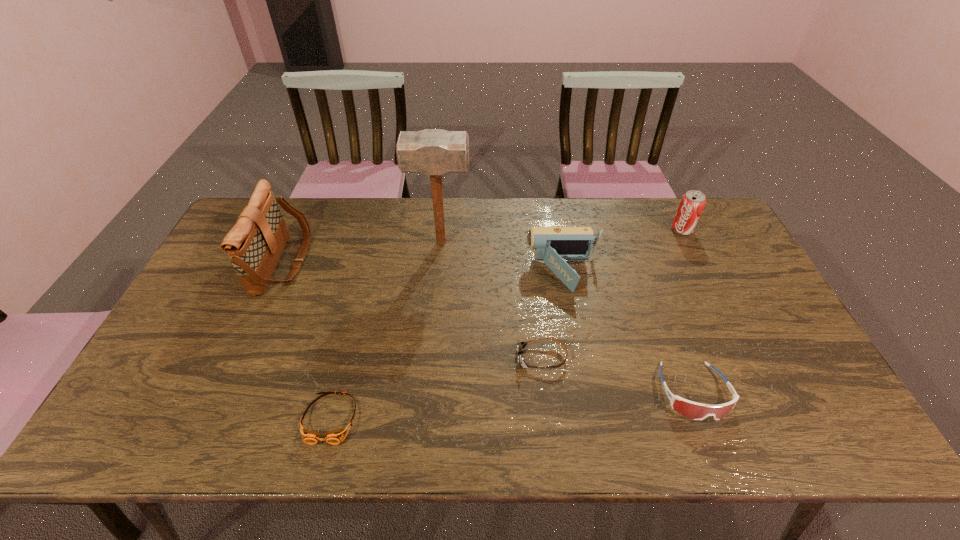
At what (x,y) coordinates should I click in order to perform the action: click on vacant space located 0.290m on the striking face of the tallest object. Please return your answer as a coordinate pair (x, y). Image resolution: width=960 pixels, height=540 pixels. Looking at the image, I should click on (x=559, y=242).

Image resolution: width=960 pixels, height=540 pixels. Find the location of `vacant space located 0.120m on the front-facing side of the leftmost object`. vacant space located 0.120m on the front-facing side of the leftmost object is located at coordinates (343, 262).

You are a GUI agent. You are given a task and a screenshot of the screen. Output one action in this format:
    pyautogui.click(x=<x>, y=<y>)
    Task: Click on the free space located on the left of the rightmost object
    The width and height of the screenshot is (960, 540).
    Given the screenshot: What is the action you would take?
    pyautogui.click(x=651, y=230)

Where is `vacant space located 0.180m on the side of the fourth tallest object with the flip-out screen`? This screenshot has width=960, height=540. vacant space located 0.180m on the side of the fourth tallest object with the flip-out screen is located at coordinates (468, 273).

Locate an element on the screen. vacant area situated on the side of the fourth tallest object with the flip-out screen is located at coordinates 399,273.

Find the location of `vacant space located on the side of the fourth tallest object with the flip-out screen`. vacant space located on the side of the fourth tallest object with the flip-out screen is located at coordinates (451, 273).

Identify the location of free space located on the front-facing side of the second goggles from left to right. (487, 358).

Identify the location of vacant area located on the front-facing side of the second goggles from left to right. (494, 358).

Identify the location of vacant space located on the front-facing side of the second goggles from left to right. This screenshot has width=960, height=540. (374, 358).

Find the location of a particular element. mallet at the far edge is located at coordinates (434, 152).